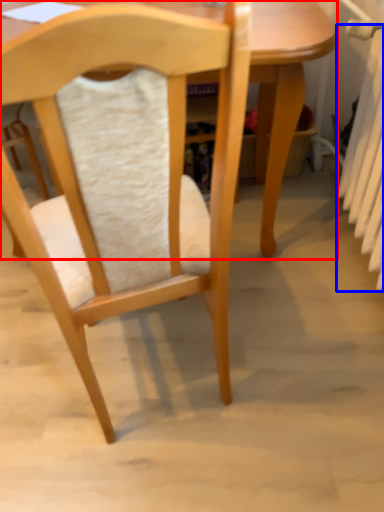
Question: Which of the following is the farthest to the observer, table (highlighted by a red box) or radiator (highlighted by a blue box)?

Choices:
 (A) table
 (B) radiator

Answer: (A)